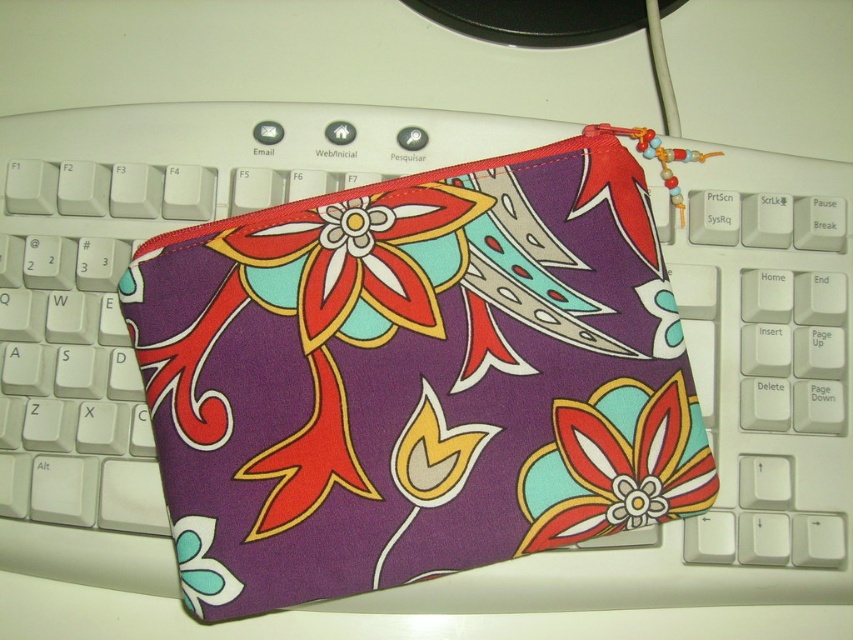
Is purple fabric pouch at center wider than matte fabric flower at center?

Indeed, purple fabric pouch at center has a greater width compared to matte fabric flower at center.

Who is more forward, (216, 371) or (550, 474)?

Point (216, 371) is more forward.

Who is more distant from viewer, (228, 380) or (593, 536)?

The point (593, 536) is more distant.

This screenshot has width=853, height=640. I want to click on purple fabric pouch at center, so click(x=415, y=378).

Who is more distant from viewer, (427, 333) or (523, 472)?

Positioned behind is point (427, 333).

Is floral fabric flower at center above matte fabric flower at center?

Yes.

The width and height of the screenshot is (853, 640). What do you see at coordinates (358, 262) in the screenshot?
I see `floral fabric flower at center` at bounding box center [358, 262].

This screenshot has width=853, height=640. I want to click on floral fabric flower at center, so click(358, 262).

This screenshot has height=640, width=853. I want to click on purple fabric pouch at center, so click(415, 378).

Does point (643, 321) come closer to viewer compared to point (453, 211)?

That is True.

Where is `purple fabric pouch at center`? Image resolution: width=853 pixels, height=640 pixels. purple fabric pouch at center is located at coordinates (415, 378).